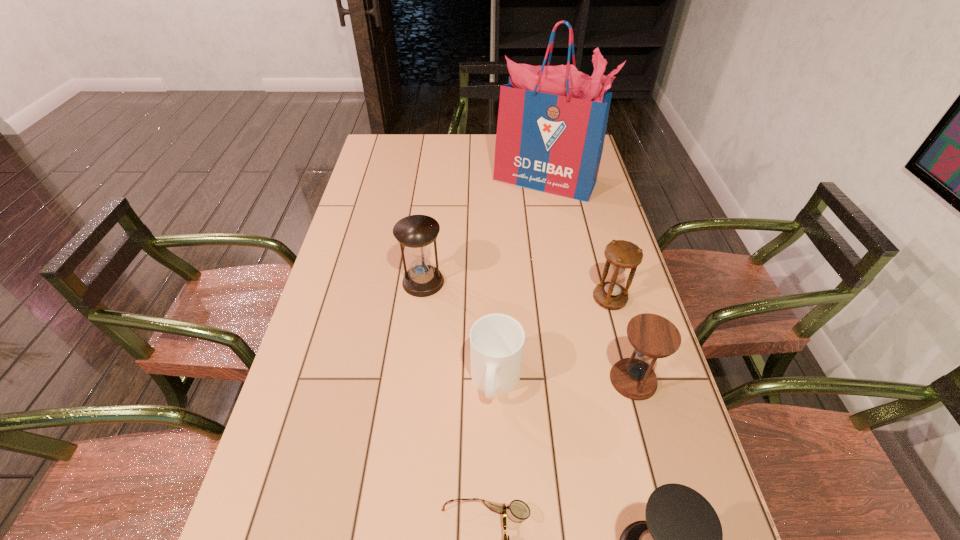
Where is `the farthest object`? The height and width of the screenshot is (540, 960). the farthest object is located at coordinates (552, 120).

At what (x,y) coordinates should I click in order to perform the action: click on the tallest object. Please return your answer as a coordinate pair (x, y). The image size is (960, 540). Looking at the image, I should click on (552, 120).

Where is `the leftmost hourglass`? the leftmost hourglass is located at coordinates (416, 232).

This screenshot has height=540, width=960. I want to click on the second nearest hourglass, so click(652, 336).

The image size is (960, 540). What are the coordinates of `the sixth tallest object` in the screenshot? It's located at (496, 340).

The width and height of the screenshot is (960, 540). Identify the location of free space located on the front-facing side of the tallest object. (551, 215).

Locate an element on the screen. free space located 0.280m on the back of the leftmost hourglass is located at coordinates (432, 209).

Find the location of a particular element. The image size is (960, 540). vacant region located on the left of the second nearest hourglass is located at coordinates (492, 380).

Locate an element on the screen. This screenshot has width=960, height=540. blank space located 0.150m on the handle side of the second shortest object is located at coordinates (498, 482).

Identify the location of object at the far edge. The height and width of the screenshot is (540, 960). (552, 120).